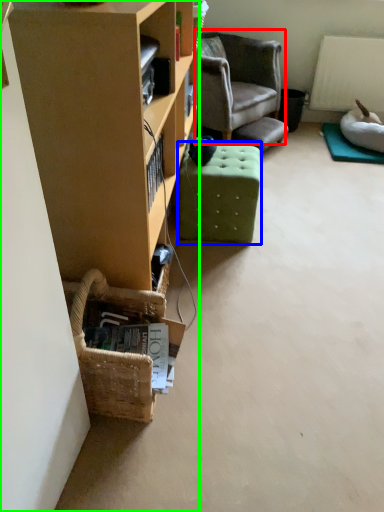
Question: Considering the real-world distances, which object is farthest from chair (highlighted by a red box)? stool (highlighted by a blue box) or cabinetry (highlighted by a green box)?

Choices:
 (A) stool
 (B) cabinetry

Answer: (B)